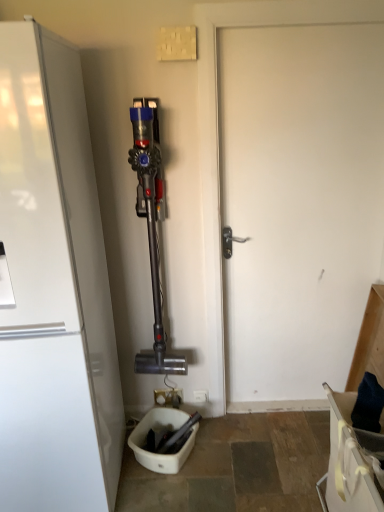
Question: From the image's perspective, relative to white glossy refrigerator at left, is white plastic electric outlet at center above or below?

Choices:
 (A) above
 (B) below

Answer: (B)

Question: In terms of width, does white plastic electric outlet at center look wider or thinner when compared to white glossy refrigerator at left?

Choices:
 (A) thin
 (B) wide

Answer: (A)

Question: Estimate the real-world distances between objects in this image. Which object is farther from the white glossy refrigerator at left?

Choices:
 (A) white matte door at center
 (B) white plastic electric outlet at center

Answer: (B)

Question: Considering the real-world distances, which object is closest to the white glossy refrigerator at left?

Choices:
 (A) white plastic electric outlet at center
 (B) white matte door at center

Answer: (B)